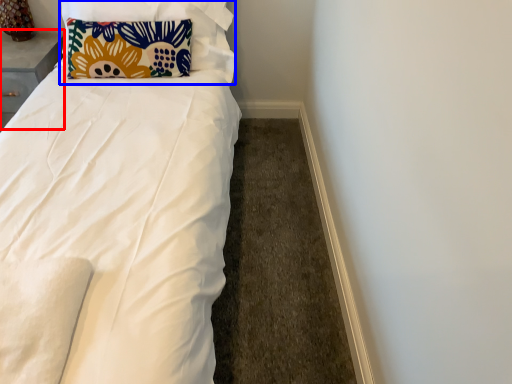
Question: Which object is further to the camera taking this photo, table (highlighted by a red box) or pillow (highlighted by a blue box)?

Choices:
 (A) table
 (B) pillow

Answer: (A)